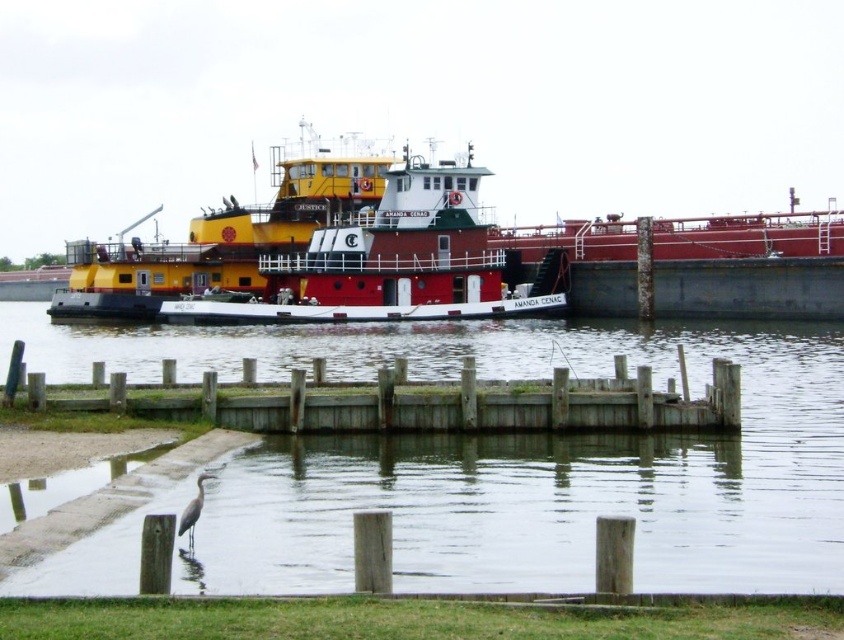
Does red matte tugboat at center lie in front of gray matte bird at lower left?

No, it is not.

Can you confirm if red matte tugboat at center is positioned above gray matte bird at lower left?

Yes, red matte tugboat at center is above gray matte bird at lower left.

This screenshot has width=844, height=640. I want to click on red matte tugboat at center, so click(387, 262).

I want to click on red matte tugboat at center, so click(x=387, y=262).

Measure the distance from smooth concrete dock at lower center to red matte tugboat at center.

smooth concrete dock at lower center is 42.35 feet away from red matte tugboat at center.

Between smooth concrete dock at lower center and red matte tugboat at center, which one appears on the right side from the viewer's perspective?

Positioned to the right is smooth concrete dock at lower center.

The height and width of the screenshot is (640, 844). What do you see at coordinates (507, 460) in the screenshot? I see `smooth concrete dock at lower center` at bounding box center [507, 460].

This screenshot has width=844, height=640. Find the location of `smooth concrete dock at lower center`. smooth concrete dock at lower center is located at coordinates (507, 460).

Is weathered wood dock at lower center wider than red matte tugboat at center?

Correct, the width of weathered wood dock at lower center exceeds that of red matte tugboat at center.

Describe the element at coordinates (407, 403) in the screenshot. This screenshot has height=640, width=844. I see `weathered wood dock at lower center` at that location.

Between point (556, 384) and point (328, 230), which one is positioned behind?

The point (328, 230) is more distant.

Locate an element on the screen. weathered wood dock at lower center is located at coordinates (407, 403).